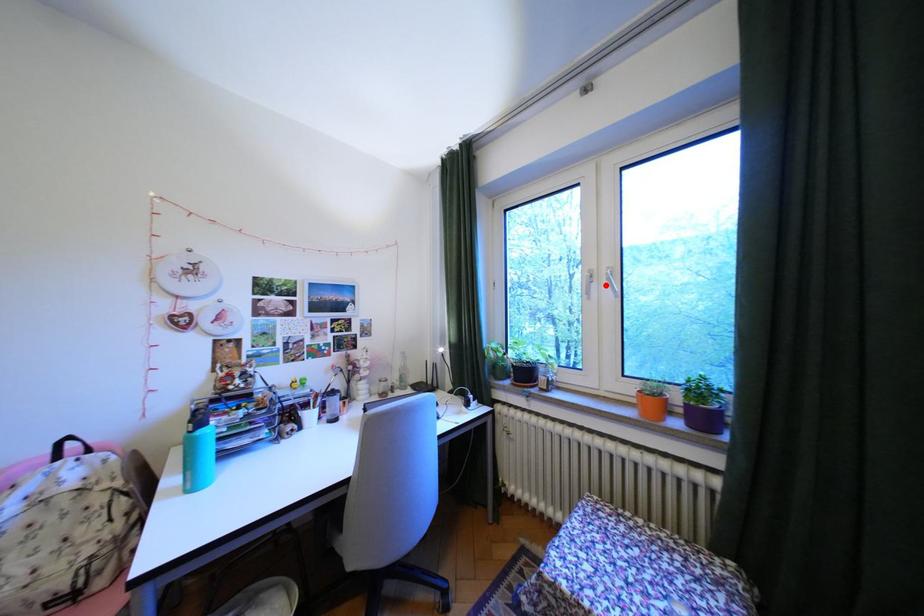
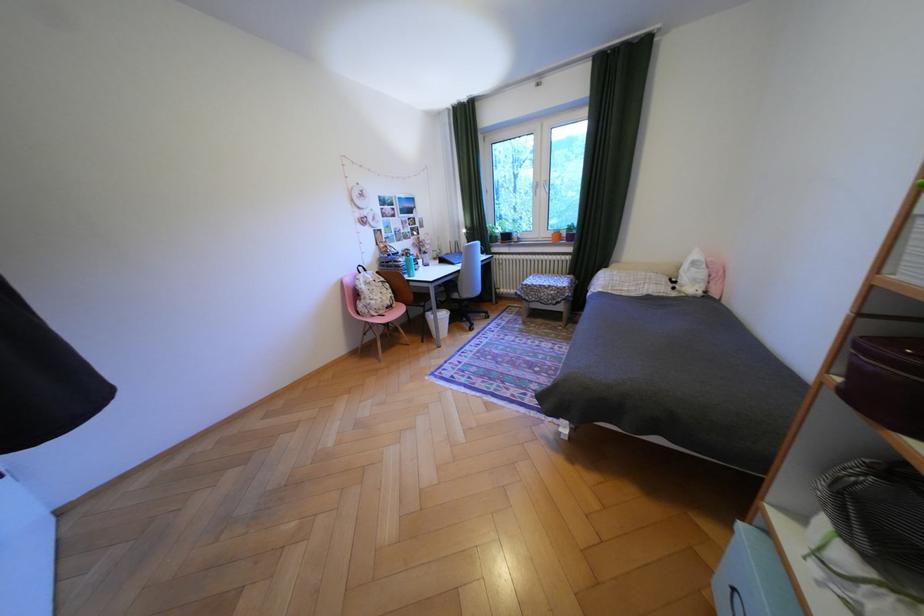
Question: I am providing you with two images of the same scene from different viewpoints. Image1 has a red point marked. In image2, the corresponding 3D location appears at what relative position? Reply with the corresponding letter.

Choices:
 (A) Closer
 (B) Farther

Answer: (A)